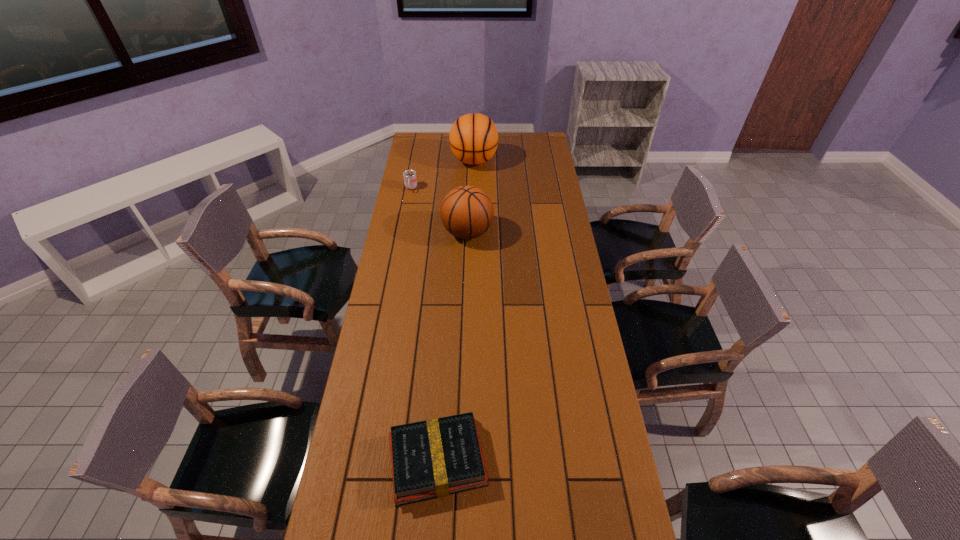
Image resolution: width=960 pixels, height=540 pixels. Find the location of `vacant space that satisfies the following two spatial constraints: 1. on the side with the handle of the hardback book; 2. on the left side of the cup`. vacant space that satisfies the following two spatial constraints: 1. on the side with the handle of the hardback book; 2. on the left side of the cup is located at coordinates (360, 460).